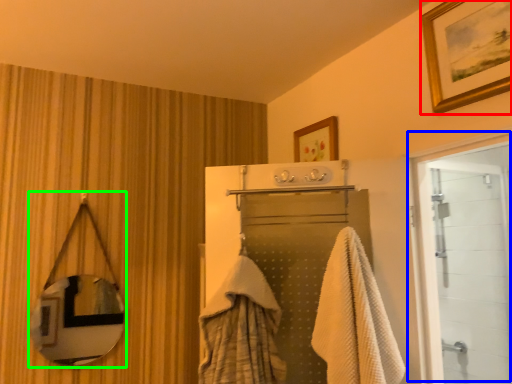
Question: Considering the real-world distances, which object is farthest from picture frame (highlighted by a red box)? door (highlighted by a blue box) or mirror (highlighted by a green box)?

Choices:
 (A) door
 (B) mirror

Answer: (B)